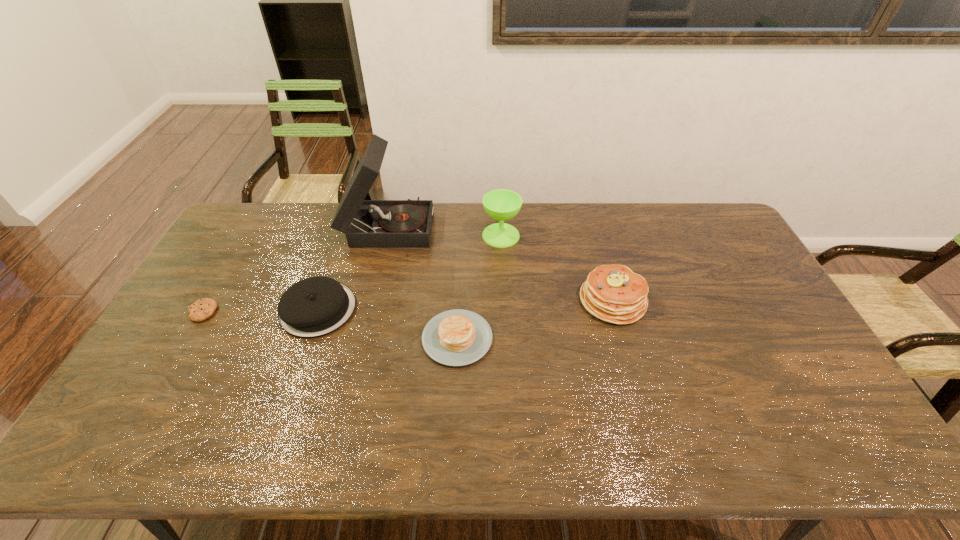
Find the location of a particular element. free spot between the second pancake from right to left and the tallest pancake is located at coordinates (535, 319).

Where is `free spot between the leftmost object and the tallest object`? free spot between the leftmost object and the tallest object is located at coordinates (296, 269).

The width and height of the screenshot is (960, 540). In order to click on vacant region between the leftmost pancake and the second tallest object in this screenshot , I will do `click(410, 272)`.

Locate an element on the screen. the third closest object to the fourth shortest object is located at coordinates (408, 223).

Select which object appears as the fourth closest to the rightmost pancake. Please provide its 2D coordinates. Your answer should be formatted as a tuple, i.e. [(x, y)], where the tuple contains the x and y coordinates of a point satisfying the conditions above.

[(313, 307)]

You are a GUI agent. You are given a task and a screenshot of the screen. Output one action in this format:
    pyautogui.click(x=<x>, y=<y>)
    Task: Click on the pancake that is the third closest to the tallest object
    
    Given the screenshot: What is the action you would take?
    pyautogui.click(x=613, y=293)

Where is `the second closest pancake to the wineglass`? the second closest pancake to the wineglass is located at coordinates (457, 337).

This screenshot has width=960, height=540. I want to click on free spot that satisfies the following two spatial constraints: 1. on the back side of the shortest pancake; 2. on the front-facing side of the phonograph_record, so click(x=463, y=226).

Locate an element on the screen. Image resolution: width=960 pixels, height=540 pixels. free space that satisfies the following two spatial constraints: 1. on the front side of the fifth shortest object; 2. on the right side of the tallest pancake is located at coordinates (504, 300).

Find the location of a particular element. The width and height of the screenshot is (960, 540). free space that satisfies the following two spatial constraints: 1. on the front-facing side of the shortest pancake; 2. on the left side of the phonograph_record is located at coordinates point(362,338).